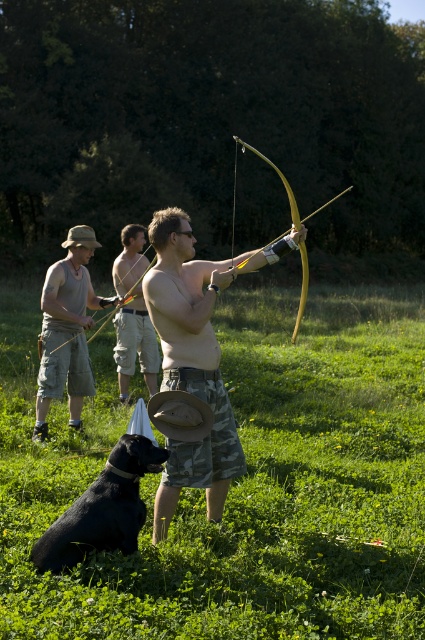
Question: Is green grassy field at center further to camera compared to matte gray shirt at center?

Choices:
 (A) yes
 (B) no

Answer: (B)

Question: Is green grassy field at center positioned behind black fur dog at lower left?

Choices:
 (A) no
 (B) yes

Answer: (A)

Question: Which of the following is the closest to the observer?

Choices:
 (A) (88, 364)
 (B) (129, 371)

Answer: (A)

Question: Which object is the farthest from the camouflage shorts at center?

Choices:
 (A) green grassy field at center
 (B) matte gray shirt at center
 (C) black fur dog at lower left

Answer: (A)

Question: Considering the relative positions of green grassy field at center and wooden bow at center in the image provided, where is green grassy field at center located with respect to wooden bow at center?

Choices:
 (A) below
 (B) above

Answer: (A)

Question: Which object is the farthest from the wooden bow at center?

Choices:
 (A) camouflage shorts at center
 (B) green grassy field at center

Answer: (A)